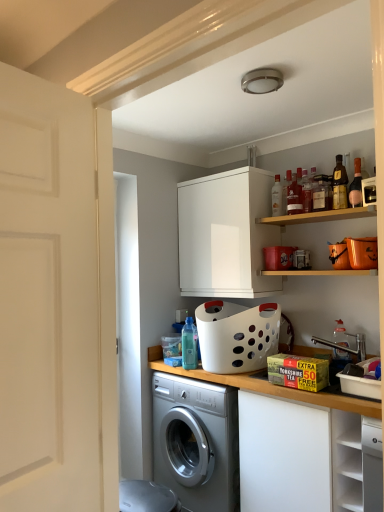
Question: From a real-world perspective, is pink glass bottle at upper right, acting as the first bottle starting from the right, on translucent glass bottle at upper center, placed as the 4th bottle when sorted from right to left?

Choices:
 (A) yes
 (B) no

Answer: (A)

Question: Is pink glass bottle at upper right, which is the 7th bottle in left-to-right order, positioned before translucent glass bottle at upper center, acting as the 4th bottle starting from the left?

Choices:
 (A) yes
 (B) no

Answer: (A)

Question: Is pink glass bottle at upper right, acting as the first bottle starting from the right, surrounding translucent glass bottle at upper center, acting as the 4th bottle starting from the left?

Choices:
 (A) yes
 (B) no

Answer: (B)

Question: Considering the relative positions of pink glass bottle at upper right, which is the 7th bottle in left-to-right order, and translucent glass bottle at upper center, acting as the 4th bottle starting from the left, in the image provided, is pink glass bottle at upper right, which is the 7th bottle in left-to-right order, behind translucent glass bottle at upper center, acting as the 4th bottle starting from the left,?

Choices:
 (A) yes
 (B) no

Answer: (B)

Question: From a real-world perspective, is pink glass bottle at upper right, which is the 7th bottle in left-to-right order, located beneath translucent glass bottle at upper center, placed as the 4th bottle when sorted from right to left?

Choices:
 (A) yes
 (B) no

Answer: (B)

Question: Looking at their shapes, would you say wooden shelf at upper right is wider or thinner than translucent glass bottle at upper center, marked as the 5th bottle in a right-to-left arrangement?

Choices:
 (A) thin
 (B) wide

Answer: (B)

Question: Is wooden shelf at upper right to the left or to the right of translucent glass bottle at upper center, positioned as the 3th bottle in left-to-right order, in the image?

Choices:
 (A) right
 (B) left

Answer: (A)

Question: Considering the positions of point (286, 216) and point (286, 185), is point (286, 216) closer or farther from the camera than point (286, 185)?

Choices:
 (A) farther
 (B) closer

Answer: (B)

Question: From the image's perspective, is wooden shelf at upper right above or below translucent glass bottle at upper center, marked as the 5th bottle in a right-to-left arrangement?

Choices:
 (A) above
 (B) below

Answer: (B)

Question: Is point (72, 153) closer or farther from the camera than point (355, 168)?

Choices:
 (A) closer
 (B) farther

Answer: (A)

Question: Based on their positions, is white matte door at left located to the left or right of pink glass bottle at upper right, which is the 7th bottle in left-to-right order?

Choices:
 (A) right
 (B) left

Answer: (B)

Question: Relative to pink glass bottle at upper right, which is the 7th bottle in left-to-right order, is white matte door at left in front or behind?

Choices:
 (A) behind
 (B) front

Answer: (B)

Question: From the image's perspective, is white matte door at left above or below pink glass bottle at upper right, which is the 7th bottle in left-to-right order?

Choices:
 (A) below
 (B) above

Answer: (A)

Question: Looking at the image, does wooden countertop at lower center seem bigger or smaller compared to pink glass bottle at upper right, acting as the first bottle starting from the right?

Choices:
 (A) big
 (B) small

Answer: (A)

Question: From the image's perspective, relative to pink glass bottle at upper right, acting as the first bottle starting from the right, is wooden countertop at lower center above or below?

Choices:
 (A) above
 (B) below

Answer: (B)